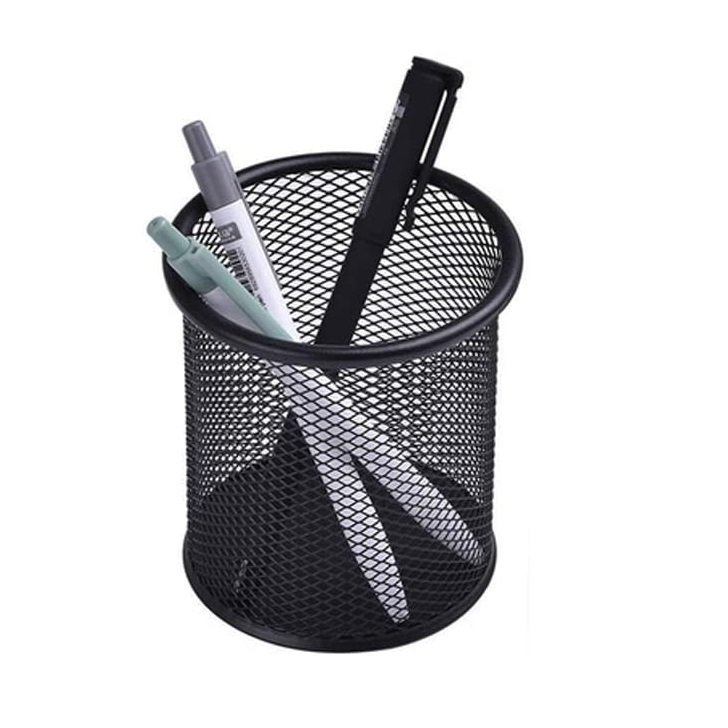
Look for three pens and a wire cup holding them in the image and show me where they are. Your answer should be formatted as a list of tuples, i.e. [(x1, y1), (x2, y2), ...], where each tuple contains the x and y coordinates of a point satisfying the conditions above.

[(408, 124), (221, 191), (191, 261), (462, 319)]